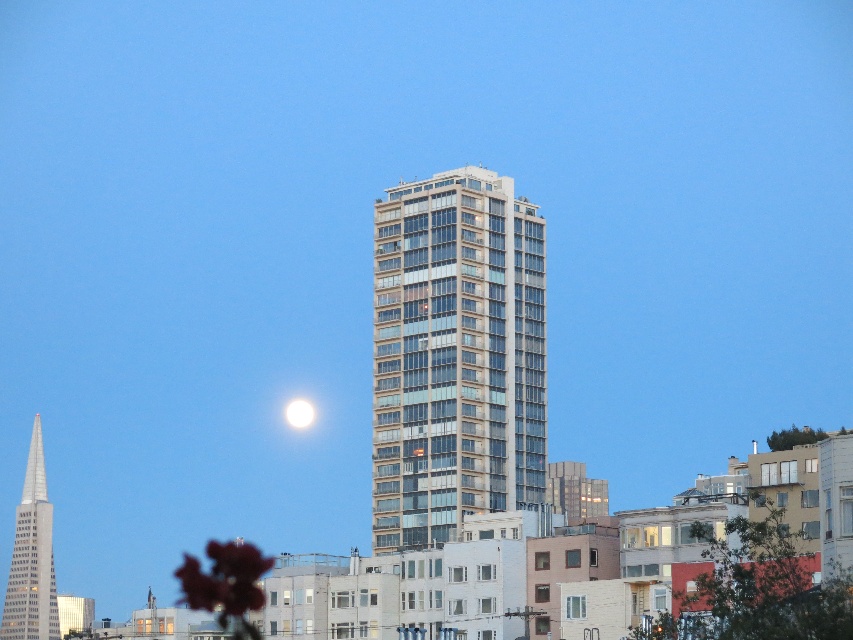
Question: Which object is the closest to the white glossy moon at upper center?

Choices:
 (A) glassy concrete building at center
 (B) polished glass skyscraper at left

Answer: (B)

Question: Can you confirm if glassy concrete building at center is positioned to the right of polished glass skyscraper at left?

Choices:
 (A) no
 (B) yes

Answer: (B)

Question: Among these points, which one is farthest from the camera?

Choices:
 (A) (308, 420)
 (B) (412, 298)
 (C) (36, 614)

Answer: (A)

Question: Is glassy concrete building at center to the right of white glossy moon at upper center from the viewer's perspective?

Choices:
 (A) yes
 (B) no

Answer: (A)

Question: Among these points, which one is nearest to the camera?

Choices:
 (A) (x=311, y=419)
 (B) (x=53, y=636)

Answer: (B)

Question: Where is glassy concrete building at center located in relation to polished glass skyscraper at left in the image?

Choices:
 (A) left
 (B) right

Answer: (B)